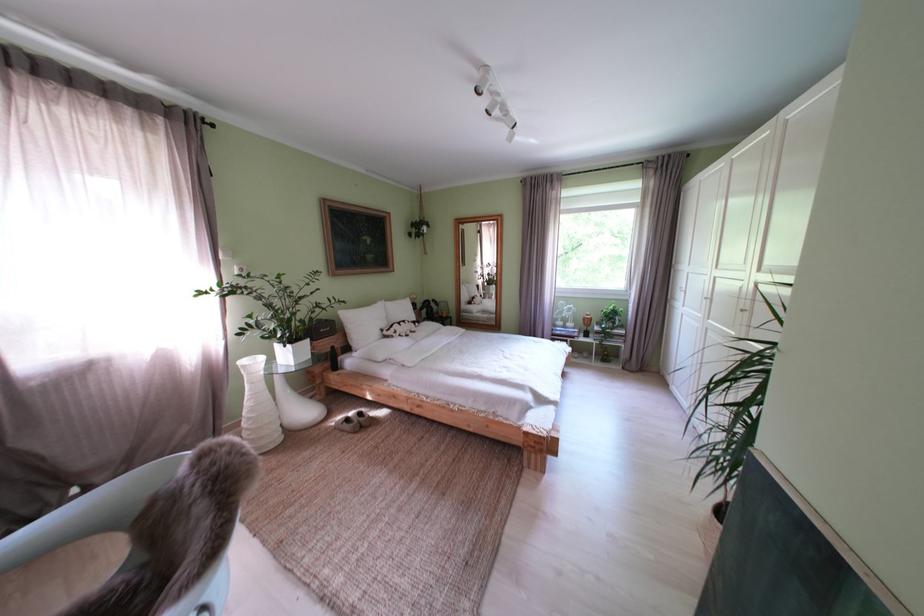
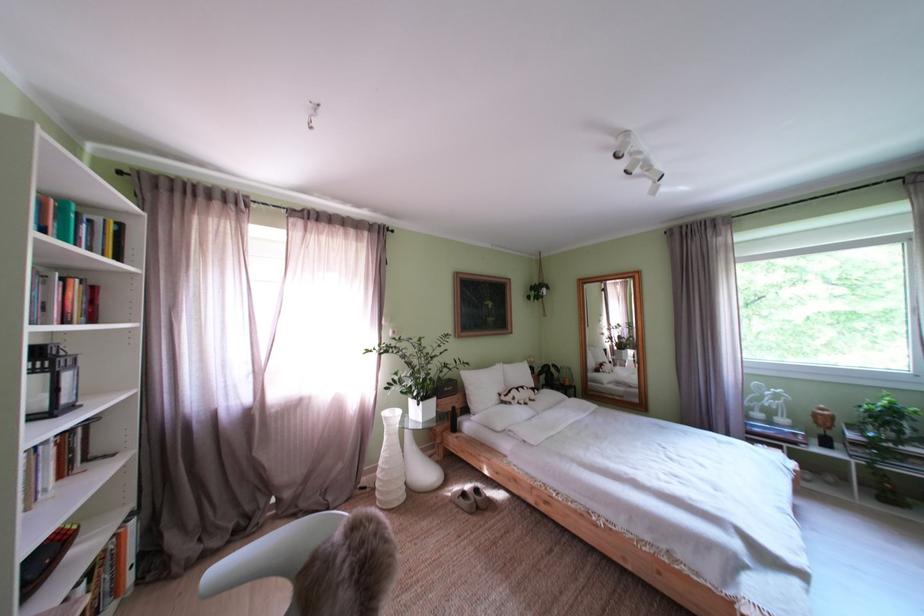
The point at (596, 325) is marked in the first image. Where is the corresponding point in the second image?

(825, 419)